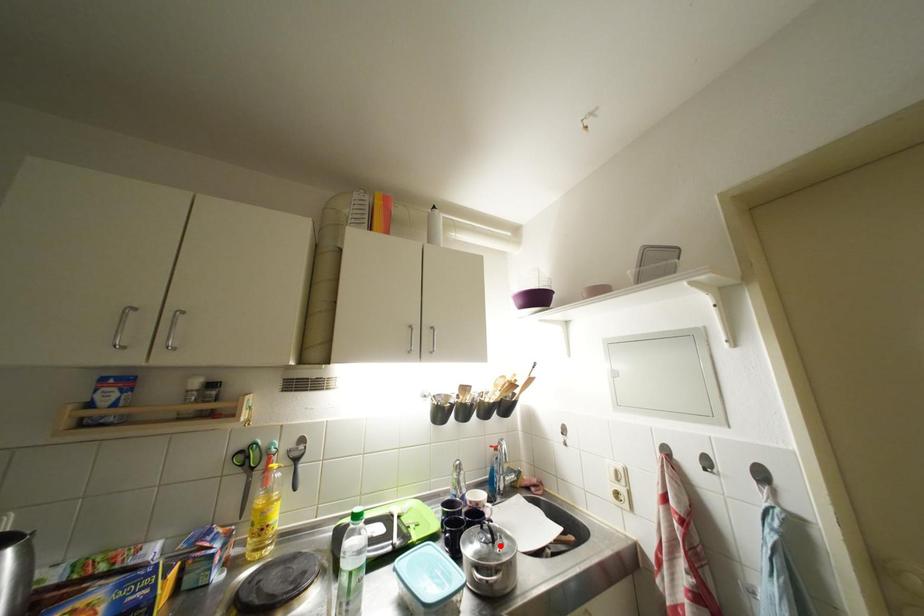
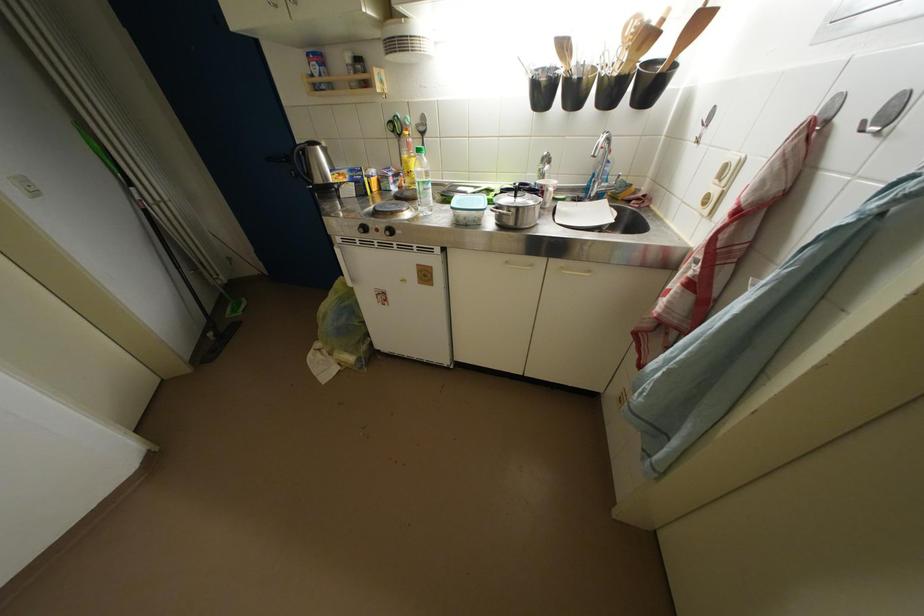
Locate, in the second image, the point that corresponds to the highlighted location in the first image.

(523, 200)